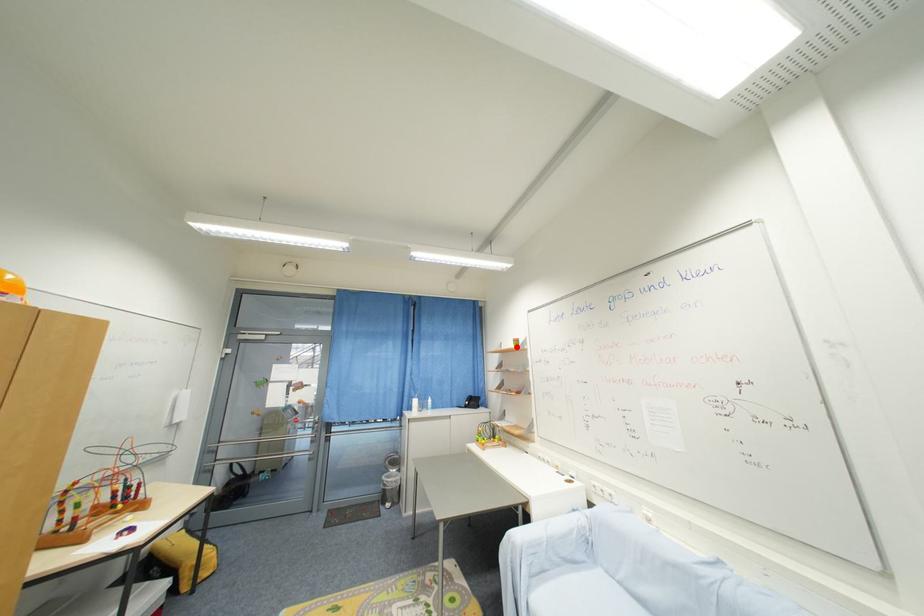
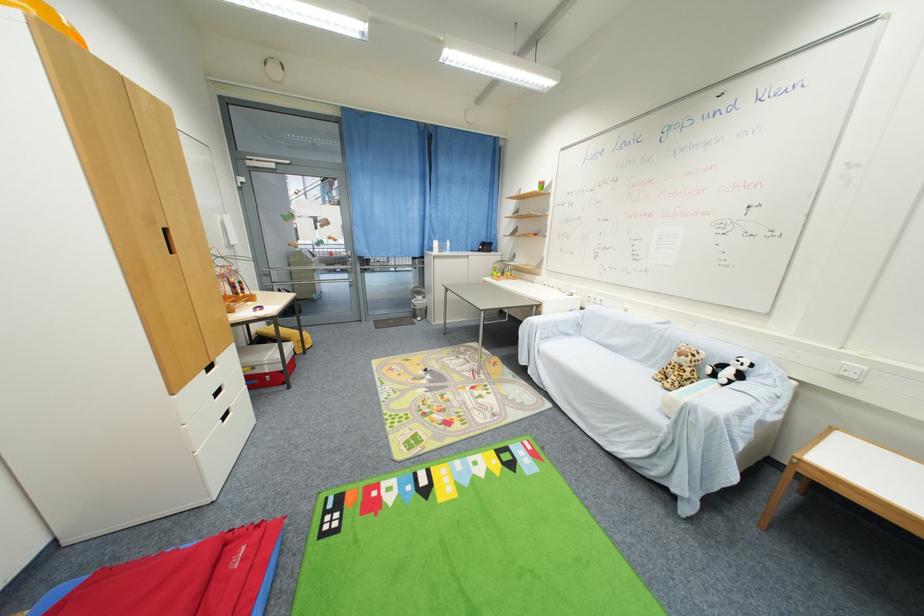
In the second image, find the point that corresponds to the highlighted location in the first image.

(541, 190)